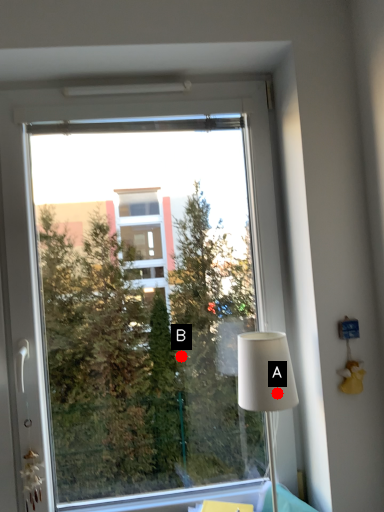
Question: Two points are circled on the image, labeled by A and B beside each circle. Which point appears closest to the camera in this image?

Choices:
 (A) A is closer
 (B) B is closer

Answer: (A)